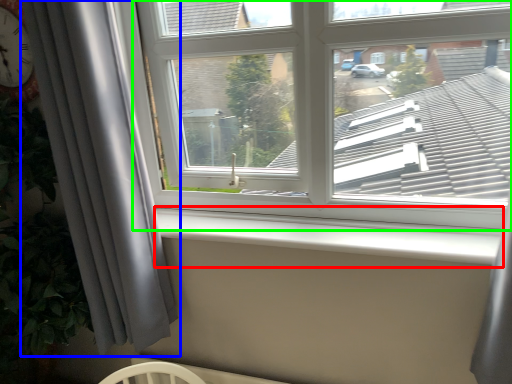
Question: Which object is positioned closest to window sill (highlighted by a red box)? Select from curtain (highlighted by a blue box) and window (highlighted by a green box).

Choices:
 (A) curtain
 (B) window

Answer: (B)